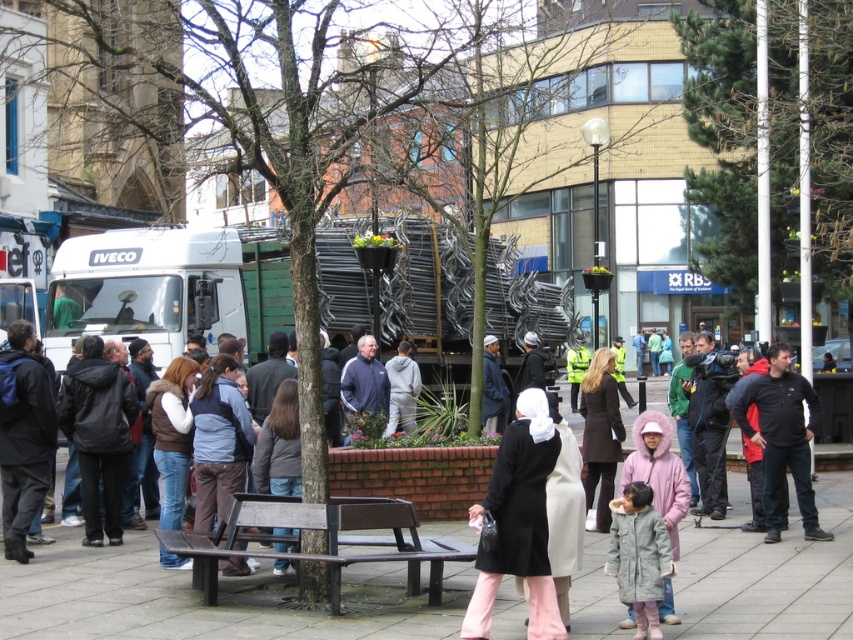
Is smooth bark tree at center thinner than pink fuzzy coat at lower right?

In fact, smooth bark tree at center might be wider than pink fuzzy coat at lower right.

The height and width of the screenshot is (640, 853). Identify the location of smooth bark tree at center. (514, 129).

Between dark blue jacket at left and black fleece jacket at right, which one appears on the right side from the viewer's perspective?

black fleece jacket at right is more to the right.

Can you confirm if dark blue jacket at left is wider than black fleece jacket at right?

No.

Is point (10, 404) farther from camera compared to point (776, 516)?

No, (10, 404) is closer to viewer.

This screenshot has width=853, height=640. I want to click on dark blue jacket at left, so click(x=22, y=436).

Does point (281, 460) come in front of point (403, 420)?

Yes, it is in front of point (403, 420).

Measure the distance from dark gray jacket at center to light gray hoodie at center.

dark gray jacket at center and light gray hoodie at center are 5.90 meters apart.

Who is more forward, (256,472) or (395,404)?

Positioned in front is point (256,472).

Locate an element on the screen. The image size is (853, 640). dark gray jacket at center is located at coordinates (279, 445).